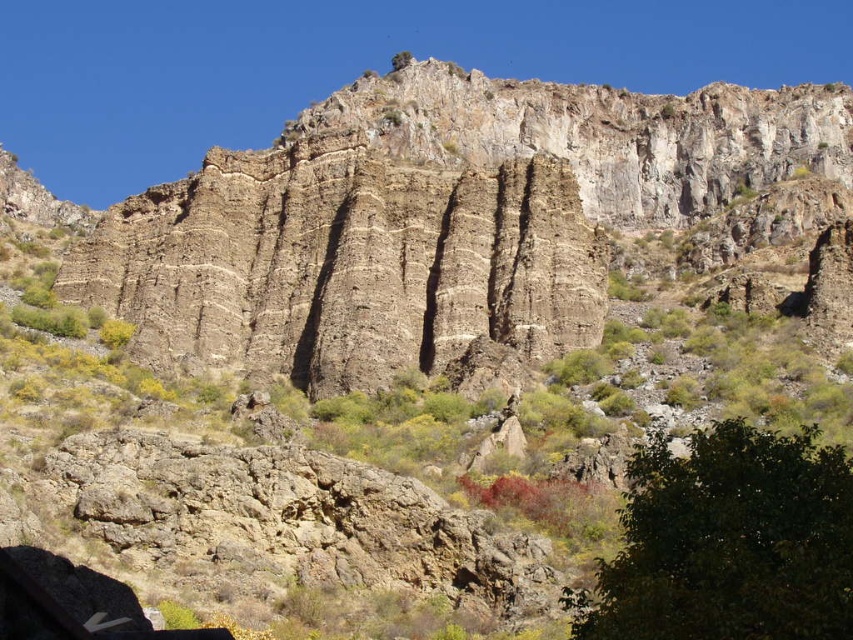
In the scene shown: Which of these two, brown rough rock face at center or green leafy tree at lower right, stands taller?

brown rough rock face at center

Which is in front, point (357, 216) or point (660, 618)?

Positioned in front is point (660, 618).

Where is `brown rough rock face at center`? Image resolution: width=853 pixels, height=640 pixels. brown rough rock face at center is located at coordinates (345, 264).